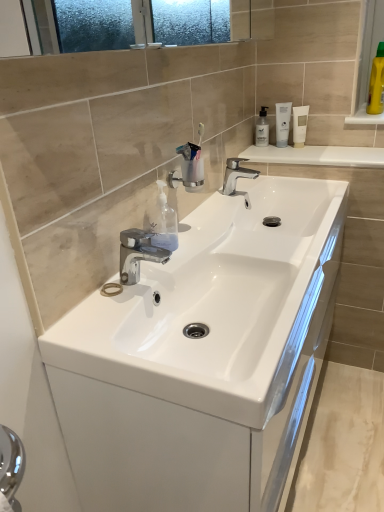
Question: From the image's perspective, relative to white matte tube at upper right, which appears as the second mouthwash when viewed from the left, is white glossy sink at center above or below?

Choices:
 (A) below
 (B) above

Answer: (A)

Question: In the image, is white glossy sink at center positioned in front of or behind white matte tube at upper right, the second mouthwash from the right?

Choices:
 (A) front
 (B) behind

Answer: (A)

Question: Which object is the closest to the transparent plastic bottle at upper right?

Choices:
 (A) transparent plastic soap dispenser at center
 (B) white matte tube at upper right, which is the 3th mouthwash in right-to-left order
 (C) white glossy sink at center
 (D) polished chrome tap at center, positioned as the first tap in back-to-front order
 (E) chrome metallic faucet at center, the 2th tap viewed from the right

Answer: (B)

Question: Which of these objects is positioned closest to the white glossy countertop at upper center?

Choices:
 (A) polished chrome tap at center, arranged as the second tap when ordered from the bottom
 (B) white matte tube at upper right, the second mouthwash from the right
 (C) transparent plastic soap dispenser at center
 (D) white glossy sink at center
 (E) yellow plastic bottle at upper right, the third mouthwash from the left

Answer: (A)